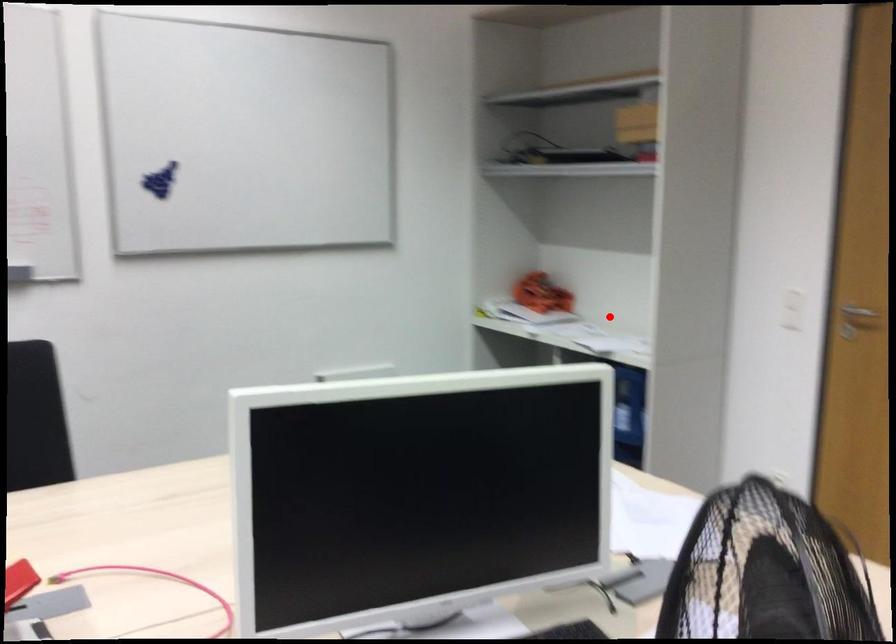
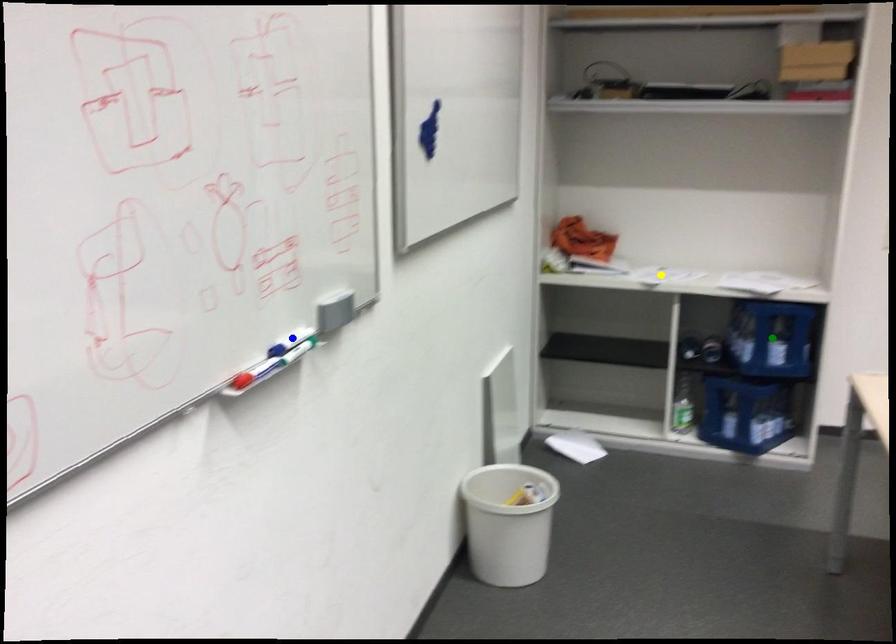
Question: I am providing you with two images of the same scene from different viewpoints. A red point is marked on the first image. You are given multiple points on the second image. Which point in image 2 represents the same 3d spot as the red point in image 1?

Choices:
 (A) yellow point
 (B) blue point
 (C) green point

Answer: (A)